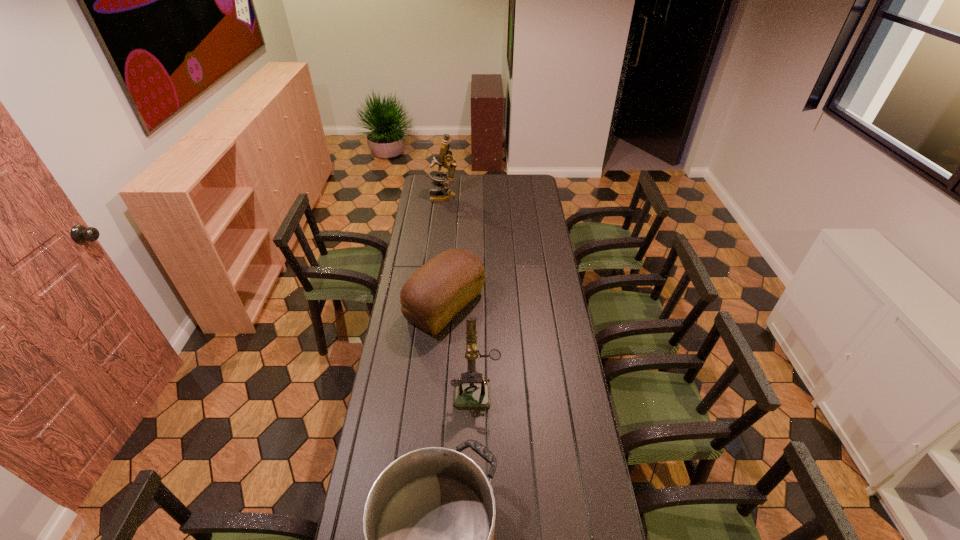
The height and width of the screenshot is (540, 960). In order to click on the left microscope in this screenshot , I will do `click(445, 157)`.

I want to click on the taller microscope, so click(445, 157).

Identify the location of the shorter microscope. (471, 395).

Locate an element on the screen. This screenshot has width=960, height=540. the right microscope is located at coordinates (471, 395).

What are the coordinates of `the second shortest object` in the screenshot? It's located at (436, 292).

Find the location of a particular element. This screenshot has width=960, height=540. the third nearest object is located at coordinates (436, 292).

Locate an element on the screen. The width and height of the screenshot is (960, 540). free space located 0.160m on the front of the tallest object is located at coordinates (442, 218).

Where is `free space located at the eyepiece of the third shortest object`? The width and height of the screenshot is (960, 540). free space located at the eyepiece of the third shortest object is located at coordinates (475, 449).

Image resolution: width=960 pixels, height=540 pixels. Identify the location of vacant area situated on the right of the third tallest object. (548, 306).

Where is `object located in the far edge section of the desktop`? Image resolution: width=960 pixels, height=540 pixels. object located in the far edge section of the desktop is located at coordinates (445, 157).